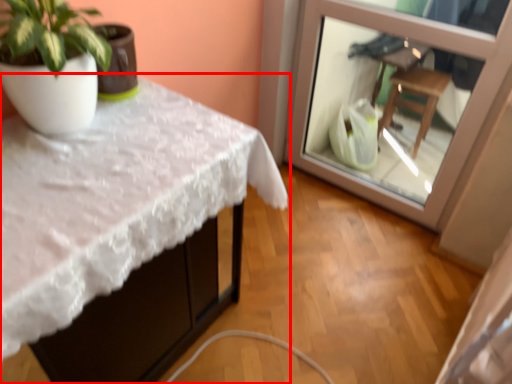
Question: From the image's perspective, what is the correct spatial positioning of table (annotated by the red box) in reference to glass door?

Choices:
 (A) below
 (B) above

Answer: (A)